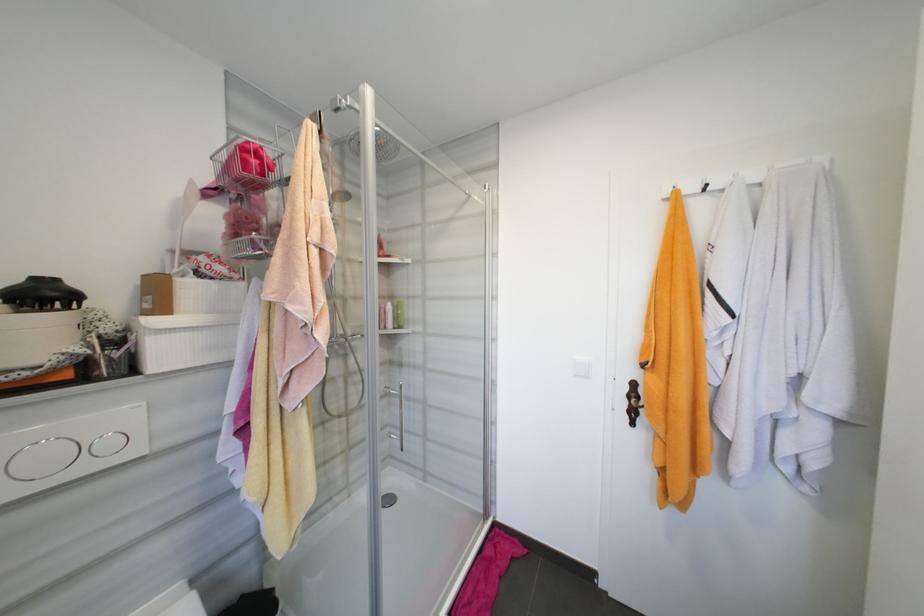
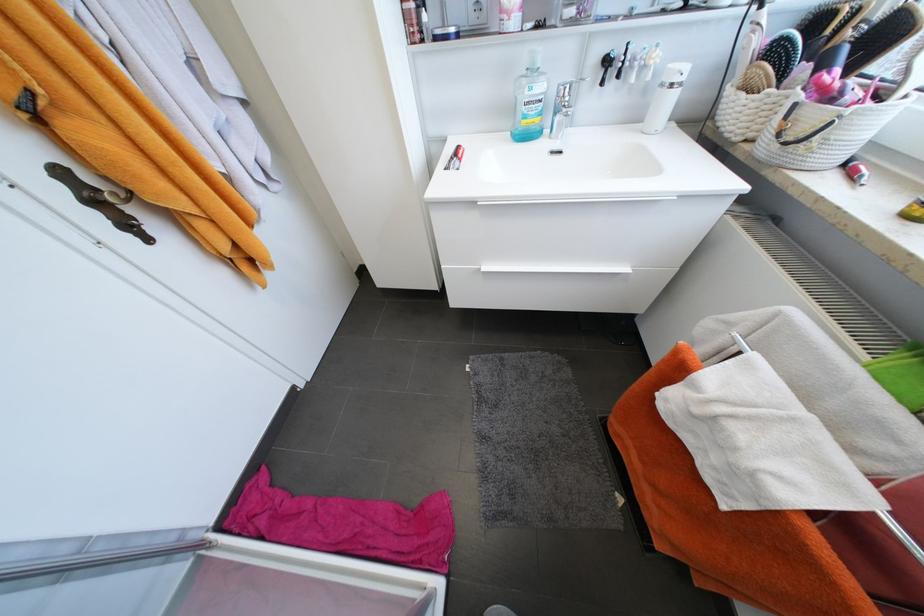
Based on the continuous images, in which direction is the camera rotating?

The camera rotated toward right-down.